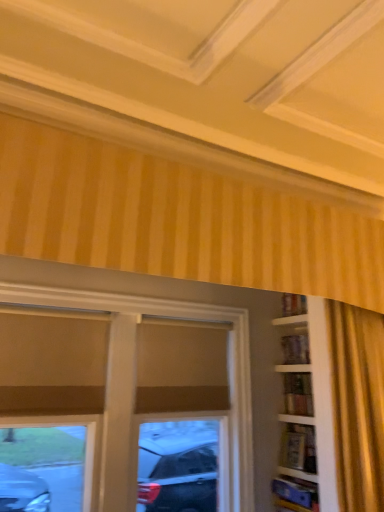
Question: Is wooden bookshelf at right, which is counted as the 1th shelf, starting from the top, wider or thinner than wooden bookshelf at right, marked as the first shelf in a bottom-to-top arrangement?

Choices:
 (A) wide
 (B) thin

Answer: (B)

Question: From a real-world perspective, is wooden bookshelf at right, which appears as the 2th shelf when ordered from the bottom, physically located above or below wooden bookshelf at right, which appears as the 2th shelf when viewed from the top?

Choices:
 (A) above
 (B) below

Answer: (A)

Question: Which is nearer to the wooden bookshelf at right, which appears as the 2th shelf when ordered from the bottom?

Choices:
 (A) matte brown window at center
 (B) wooden bookshelf at right, marked as the first shelf in a bottom-to-top arrangement

Answer: (B)

Question: Considering the real-world distances, which object is farthest from the wooden bookshelf at right, which appears as the 2th shelf when ordered from the bottom?

Choices:
 (A) matte brown window at center
 (B) wooden bookshelf at right, marked as the first shelf in a bottom-to-top arrangement

Answer: (A)